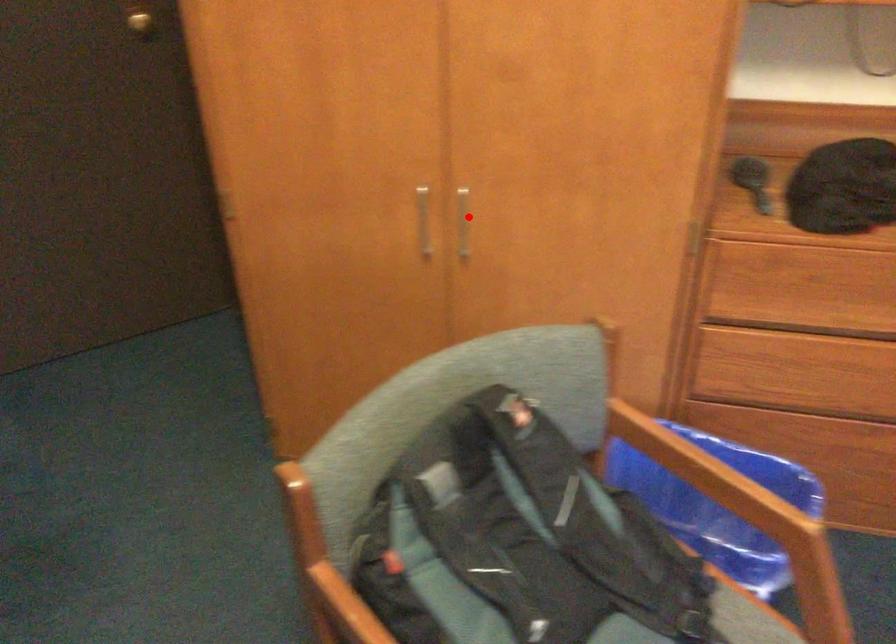
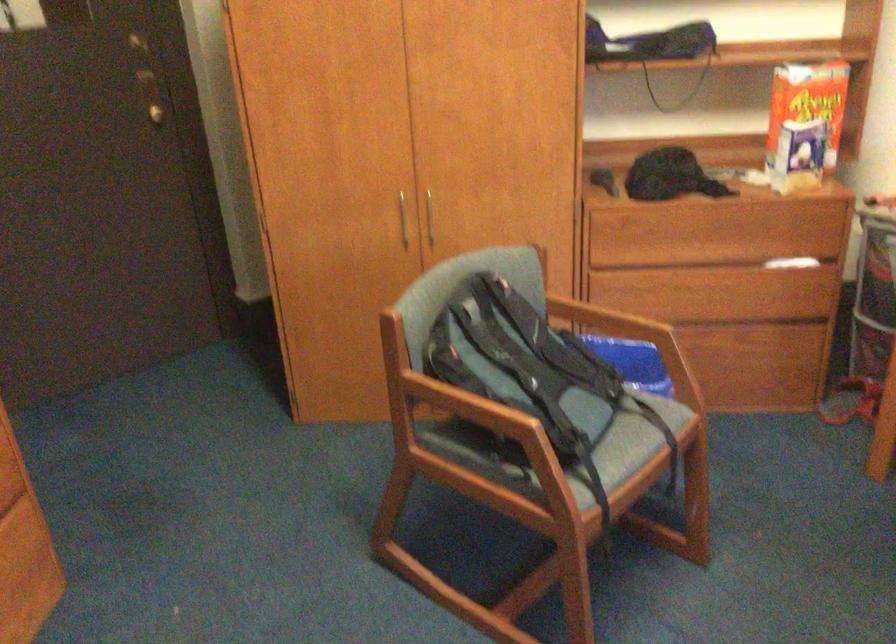
The point at the highlighted location is marked in the first image. Where is the corresponding point in the second image?

(428, 218)